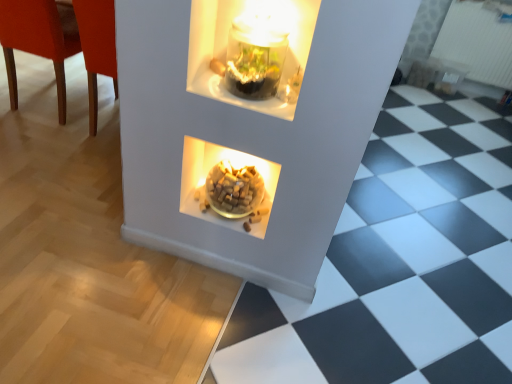
Locate an element on the screen. The height and width of the screenshot is (384, 512). translucent glass bowl at center is located at coordinates (208, 171).

Is white textured radiator at upper right at the right side of matte wood chair at left?

Yes.

How different are the orientations of white textured radiator at upper right and matte wood chair at left in degrees?

There is a 176-degree angle between the facing directions of white textured radiator at upper right and matte wood chair at left.

Is matte wood chair at left at the back of white textured radiator at upper right?

No, white textured radiator at upper right is not facing away from matte wood chair at left.

Measure the distance between white textured radiator at upper right and matte wood chair at left.

white textured radiator at upper right and matte wood chair at left are 3.04 meters apart from each other.

In the scene shown: From the image's perspective, is translucent glass bowl at center above white textured radiator at upper right?

Incorrect, from the image's perspective, translucent glass bowl at center is lower than white textured radiator at upper right.

Which is nearer, (224, 156) or (507, 35)?

Clearly, point (224, 156) is closer to the camera than point (507, 35).

Would you say white textured radiator at upper right is part of translucent glass bowl at center's contents?

No, translucent glass bowl at center does not contain white textured radiator at upper right.

Is translucent glass bowl at center oriented away from white textured radiator at upper right?

No, translucent glass bowl at center is not facing away from white textured radiator at upper right.

Which object is positioned more to the right, translucent glass bowl at center or matte wood chair at left?

translucent glass bowl at center.

Could you tell me if translucent glass bowl at center is turned towards matte wood chair at left?

No, translucent glass bowl at center does not turn towards matte wood chair at left.

The height and width of the screenshot is (384, 512). Find the location of `chair below the translucent glass bowl at center (from a real-world perspective)`. chair below the translucent glass bowl at center (from a real-world perspective) is located at coordinates (39, 40).

Between white textured radiator at upper right and translucent glass bowl at center, which one has smaller size?

translucent glass bowl at center is smaller.

Are white textured radiator at upper right and translucent glass bowl at center making contact?

white textured radiator at upper right and translucent glass bowl at center are not in contact.

From a real-world perspective, does white textured radiator at upper right sit lower than translucent glass bowl at center?

No.

From the image's perspective, is white textured radiator at upper right over translucent glass bowl at center?

Yes, from the image's perspective, white textured radiator at upper right is over translucent glass bowl at center.

Is point (65, 86) in front of point (495, 73)?

Yes, point (65, 86) is closer to viewer.

From the image's perspective, is matte wood chair at left located beneath white textured radiator at upper right?

Yes, from the image's perspective, matte wood chair at left is below white textured radiator at upper right.

Does matte wood chair at left have a smaller size compared to white textured radiator at upper right?

Actually, matte wood chair at left might be larger than white textured radiator at upper right.

Do you think matte wood chair at left is within translucent glass bowl at center, or outside of it?

matte wood chair at left is located beyond the bounds of translucent glass bowl at center.

Which of these two, matte wood chair at left or translucent glass bowl at center, stands taller?

matte wood chair at left.

In terms of width, does matte wood chair at left look wider or thinner when compared to translucent glass bowl at center?

Clearly, matte wood chair at left has more width compared to translucent glass bowl at center.

Is matte wood chair at left touching translucent glass bowl at center?

No, matte wood chair at left is not with translucent glass bowl at center.

You are a GUI agent. You are given a task and a screenshot of the screen. Output one action in this format:
    pyautogui.click(x=<x>, y=<y>)
    Task: Click on the radiator above the matte wood chair at left (from a real-world perspective)
    This screenshot has height=384, width=512.
    Given the screenshot: What is the action you would take?
    pyautogui.click(x=477, y=43)

I want to click on fireplace in front of the white textured radiator at upper right, so click(208, 171).

Estimate the real-world distances between objects in this image. Which object is further from white textured radiator at upper right, translucent glass bowl at center or matte wood chair at left?

matte wood chair at left is further to white textured radiator at upper right.

When comparing their distances from matte wood chair at left, does white textured radiator at upper right or translucent glass bowl at center seem closer?

Based on the image, translucent glass bowl at center appears to be nearer to matte wood chair at left.

Based on their spatial positions, is matte wood chair at left or white textured radiator at upper right further from translucent glass bowl at center?

white textured radiator at upper right lies further to translucent glass bowl at center than the other object.

Which object lies nearer to the anchor point translucent glass bowl at center, white textured radiator at upper right or matte wood chair at left?

matte wood chair at left is closer to translucent glass bowl at center.

Which object lies further to the anchor point matte wood chair at left, translucent glass bowl at center or white textured radiator at upper right?

Based on the image, white textured radiator at upper right appears to be further to matte wood chair at left.

From the image, which object appears to be farther from white textured radiator at upper right, matte wood chair at left or translucent glass bowl at center?

The object further to white textured radiator at upper right is matte wood chair at left.

Image resolution: width=512 pixels, height=384 pixels. I want to click on fireplace between matte wood chair at left and white textured radiator at upper right, so click(x=208, y=171).